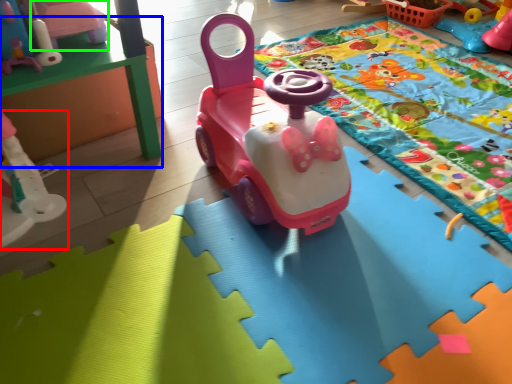
Question: Estimate the real-world distances between objects in this image. Which object is closer to toy (highlighted by a red box), table (highlighted by a blue box) or toy (highlighted by a green box)?

Choices:
 (A) table
 (B) toy

Answer: (A)